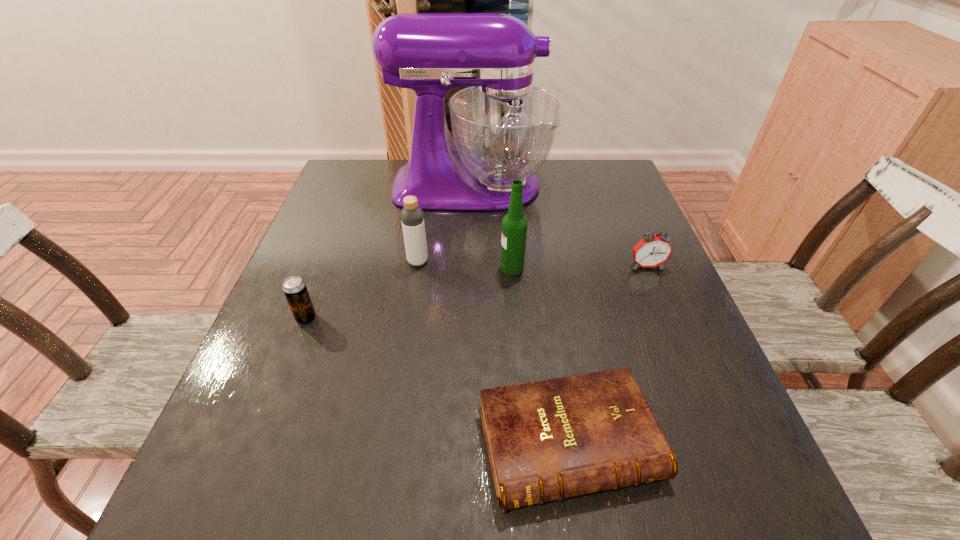
This screenshot has width=960, height=540. In order to click on free spot located on the label of the fifth shortest object in this screenshot , I will do `click(448, 267)`.

Where is `free space located 0.160m on the label of the fifth shortest object`? This screenshot has height=540, width=960. free space located 0.160m on the label of the fifth shortest object is located at coordinates (431, 267).

Where is `vacant point located on the label of the fifth shortest object`? This screenshot has height=540, width=960. vacant point located on the label of the fifth shortest object is located at coordinates (387, 267).

Locate an element on the screen. This screenshot has height=540, width=960. blank space located on the left of the fourth shortest object is located at coordinates (369, 261).

Locate an element on the screen. Image resolution: width=960 pixels, height=540 pixels. vacant area situated on the clock face of the rightmost object is located at coordinates (676, 336).

Where is `vacant space positioned on the front of the beer can`? vacant space positioned on the front of the beer can is located at coordinates (245, 476).

Identify the location of vacant space situated on the back of the nearest object. (553, 344).

Identify the location of object that is at the far edge. pos(503,127).

Where is `object present at the near edge`? object present at the near edge is located at coordinates (551, 439).

Identify the location of object positioned at the left edge. (294, 288).